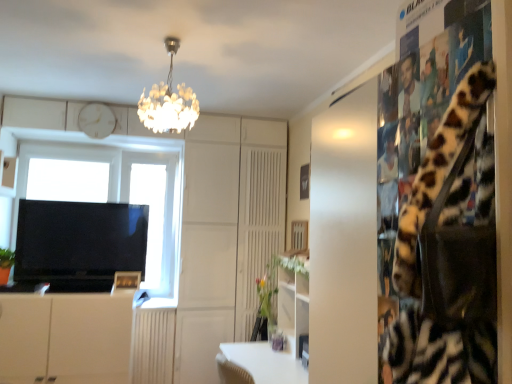
Question: Is the position of transparent glass window at center less distant than that of wooden picture frame at lower center?

Choices:
 (A) no
 (B) yes

Answer: (A)

Question: Considering the relative sizes of transparent glass window at center and wooden picture frame at lower center in the image provided, is transparent glass window at center wider than wooden picture frame at lower center?

Choices:
 (A) no
 (B) yes

Answer: (B)

Question: From a real-world perspective, is transparent glass window at center on top of wooden picture frame at lower center?

Choices:
 (A) yes
 (B) no

Answer: (A)

Question: Is there a large distance between transparent glass window at center and wooden picture frame at lower center?

Choices:
 (A) yes
 (B) no

Answer: (A)

Question: Considering the relative sizes of transparent glass window at center and wooden picture frame at lower center in the image provided, is transparent glass window at center smaller than wooden picture frame at lower center?

Choices:
 (A) yes
 (B) no

Answer: (B)

Question: Is transparent glass window at center oriented away from wooden picture frame at lower center?

Choices:
 (A) yes
 (B) no

Answer: (B)

Question: Considering the relative sizes of wooden picture frame at lower center and white matte clock at upper center in the image provided, is wooden picture frame at lower center shorter than white matte clock at upper center?

Choices:
 (A) no
 (B) yes

Answer: (B)

Question: Is wooden picture frame at lower center aimed at white matte clock at upper center?

Choices:
 (A) yes
 (B) no

Answer: (B)

Question: Considering the relative positions of wooden picture frame at lower center and white matte clock at upper center in the image provided, is wooden picture frame at lower center behind white matte clock at upper center?

Choices:
 (A) no
 (B) yes

Answer: (A)

Question: Is wooden picture frame at lower center oriented away from white matte clock at upper center?

Choices:
 (A) no
 (B) yes

Answer: (A)

Question: Is wooden picture frame at lower center wider than white matte clock at upper center?

Choices:
 (A) no
 (B) yes

Answer: (A)

Question: From a real-world perspective, does wooden picture frame at lower center sit lower than white matte clock at upper center?

Choices:
 (A) yes
 (B) no

Answer: (A)

Question: Is green matte vase at center placed right next to wooden picture frame at lower center?

Choices:
 (A) no
 (B) yes

Answer: (A)